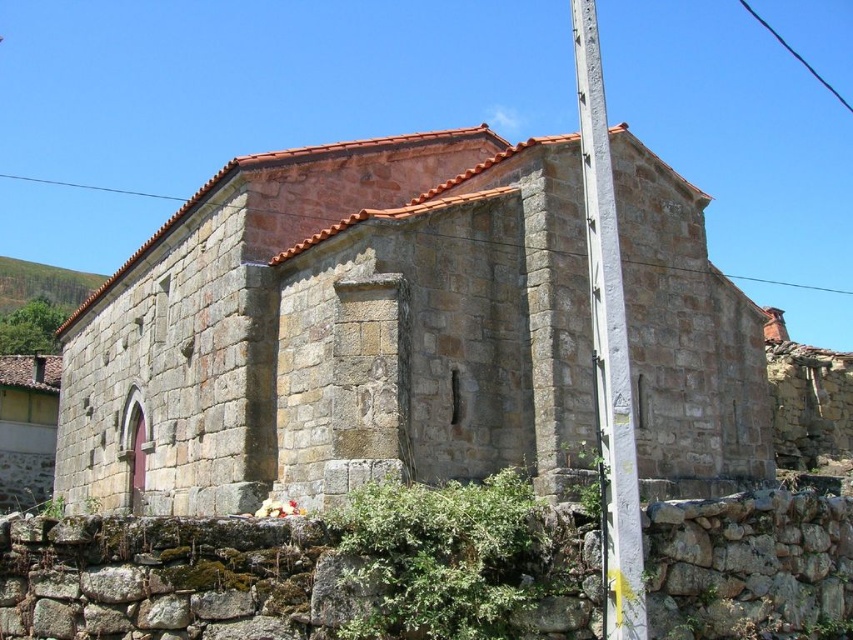
In the scene shown: You are standing at coordinates 0.5, 0.4 and want to reach the stone chapel at center. Is the chapel directly in front of you or to one side?

The stone chapel at center is located at point (338, 328), which is very close to your current position at (340, 320). It is directly in front of you with a slight offset to the lower side.

In the scene shown: You are a photographer planning to capture the stone chapel at center and the white painted metal pole at right in a single frame. Based on their sizes, which object will appear bigger in your photo?

The stone chapel at center will appear bigger in the photo because its width is larger than that of the white painted metal pole at right.